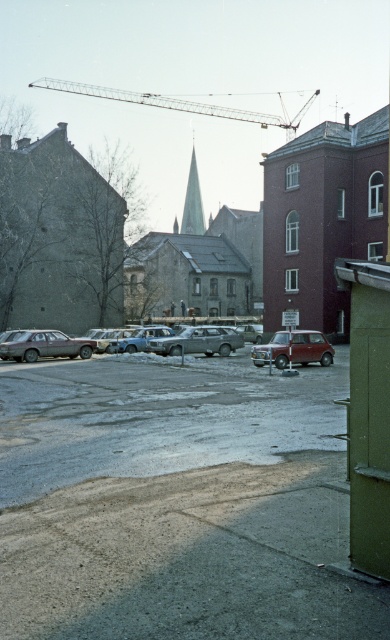
Question: Among these objects, which one is nearest to the camera?

Choices:
 (A) matte gray car at lower left
 (B) metallic red car at center

Answer: (B)

Question: In this image, where is metallic gray crane at upper center located relative to silver metallic car at center?

Choices:
 (A) above
 (B) below

Answer: (A)

Question: Among these points, which one is farthest from the camera?

Choices:
 (A) (276, 333)
 (B) (189, 214)
 (C) (216, 112)
 (D) (164, 326)

Answer: (C)

Question: Can you confirm if metallic gray crane at upper center is wider than smooth gray spire at center?

Choices:
 (A) no
 (B) yes

Answer: (B)

Question: Is matte gray car at lower left behind light blue metallic car at center?

Choices:
 (A) yes
 (B) no

Answer: (B)

Question: Which of these objects is positioned closest to the metallic red car at center?

Choices:
 (A) smooth gray spire at center
 (B) metallic gray crane at upper center

Answer: (A)